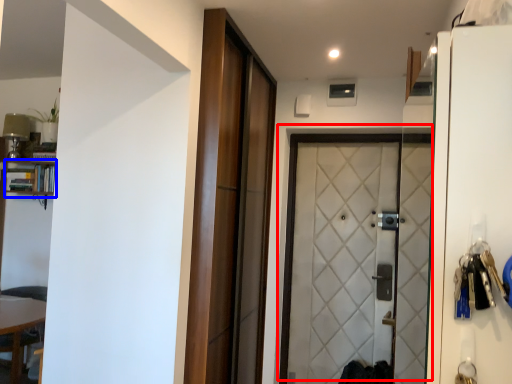
Question: Among these objects, which one is nearest to the camera, door (highlighted by a red box) or bookshelf (highlighted by a blue box)?

Choices:
 (A) door
 (B) bookshelf

Answer: (A)